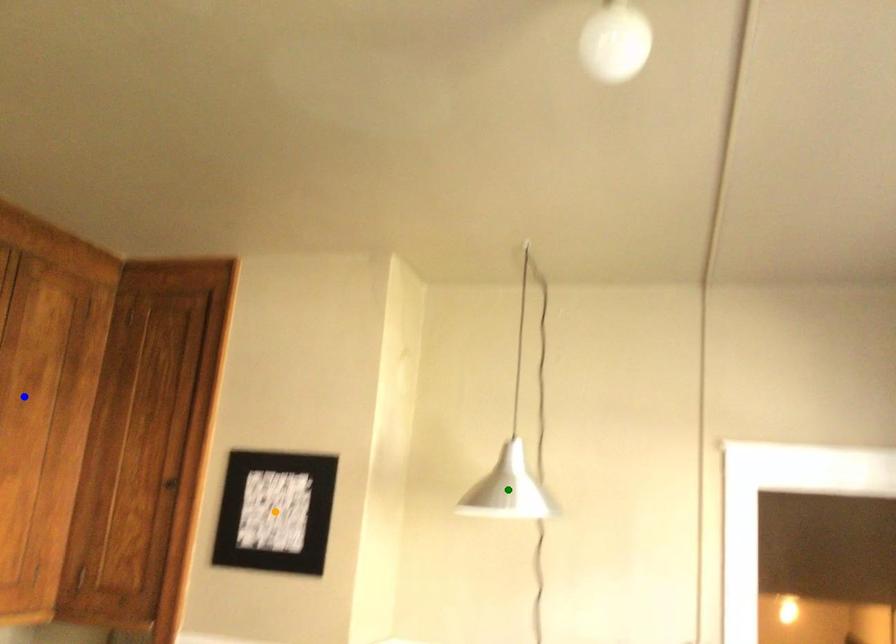
Order these from nearest to farthest:
- orange point
- blue point
- green point

blue point < orange point < green point